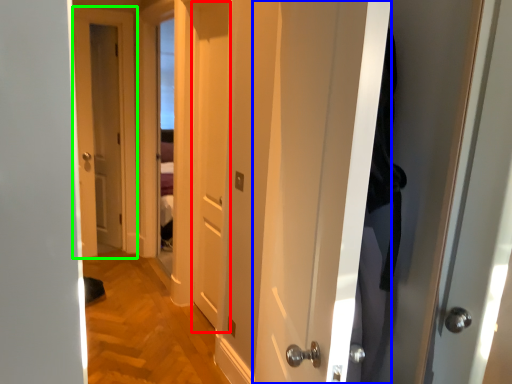
Question: Which object is the farthest from door (highlighted by a red box)? Choose among these: door (highlighted by a blue box) or door (highlighted by a green box).

Choices:
 (A) door
 (B) door

Answer: (B)